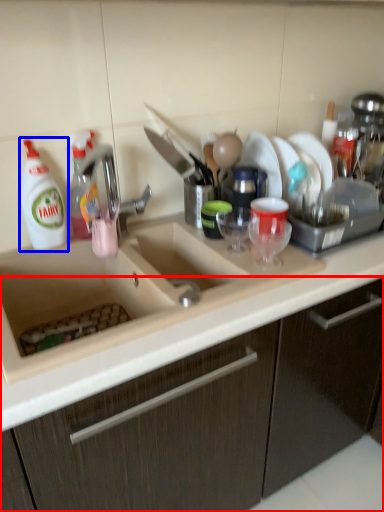
Question: Which object is further to the camera taking this photo, cabinetry (highlighted by a red box) or cleaning product (highlighted by a blue box)?

Choices:
 (A) cabinetry
 (B) cleaning product

Answer: (B)